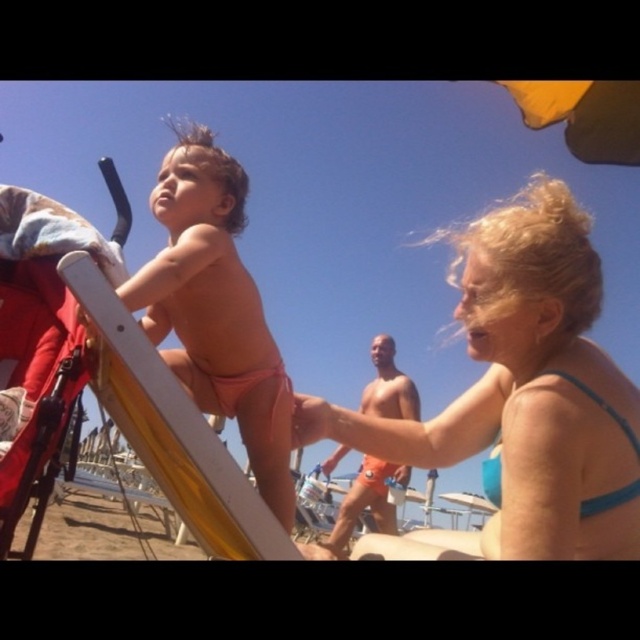
Question: Is blue fabric bikini top at upper right wider than orange fabric shorts at center?

Choices:
 (A) no
 (B) yes

Answer: (A)

Question: Which of these objects is positioned closest to the blue fabric bikini top at upper right?

Choices:
 (A) orange fabric shorts at center
 (B) pink matte swimsuit at center

Answer: (B)

Question: Is pink matte swimsuit at center bigger than orange fabric shorts at center?

Choices:
 (A) yes
 (B) no

Answer: (B)

Question: Which point is farther to the camera?

Choices:
 (A) (387, 524)
 (B) (173, 218)
 (C) (548, 528)

Answer: (A)

Question: Among these points, which one is farthest from the camera?

Choices:
 (A) (234, 216)
 (B) (404, 481)
 (C) (458, 403)

Answer: (B)

Question: Can you confirm if blue fabric bikini top at upper right is positioned below pink matte swimsuit at center?

Choices:
 (A) yes
 (B) no

Answer: (A)